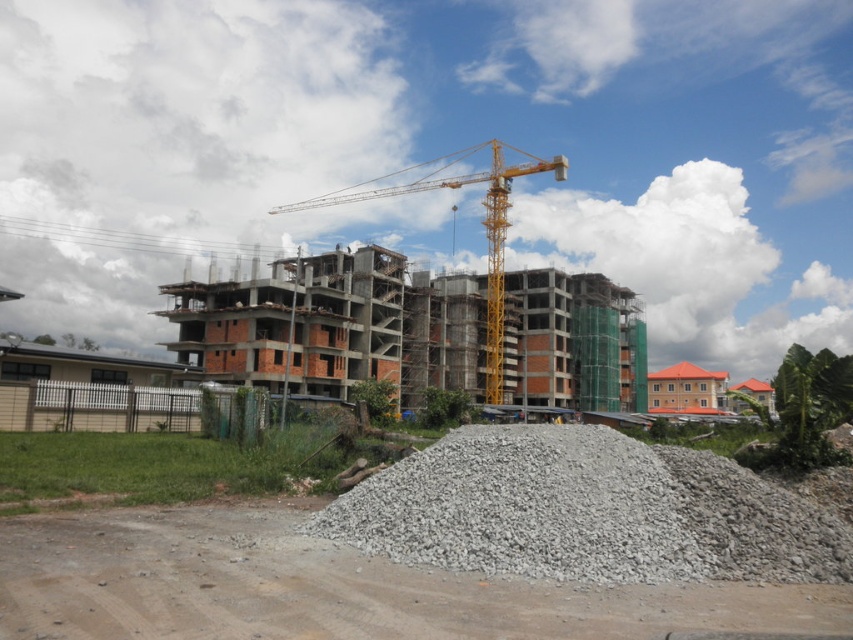
How far apart are gray gravel pile at lower center and yellow metallic crane at center?

115.58 meters

This screenshot has width=853, height=640. What do you see at coordinates (332, 588) in the screenshot?
I see `gray gravel pile at lower center` at bounding box center [332, 588].

Identify the location of gray gravel pile at lower center. (332, 588).

Does gray gravel pile at lower center appear under brick building at center?

Yes, gray gravel pile at lower center is below brick building at center.

Is gray gravel pile at lower center above brick building at center?

No.

Is point (90, 595) behind point (512, 288)?

No.

The height and width of the screenshot is (640, 853). What are the coordinates of `gray gravel pile at lower center` in the screenshot? It's located at (332, 588).

From the picture: Does gray gravel at lower center lie in front of brick building at center?

Yes, gray gravel at lower center is closer to the viewer.

Can you confirm if gray gravel at lower center is positioned to the right of brick building at center?

No, gray gravel at lower center is not to the right of brick building at center.

Locate an element on the screen. gray gravel at lower center is located at coordinates (585, 512).

Where is `gray gravel at lower center`? gray gravel at lower center is located at coordinates (585, 512).